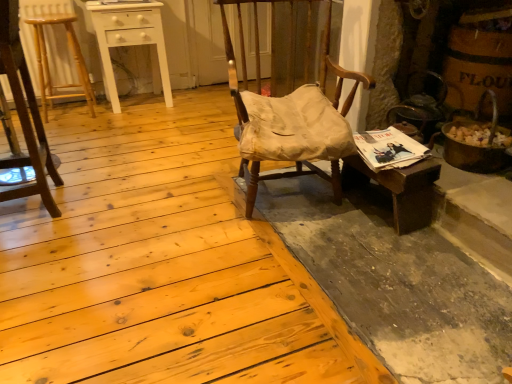
Locate an element on the screen. This screenshot has width=512, height=384. blank space above wooden desk at right (from a real-world perspective) is located at coordinates click(x=398, y=159).